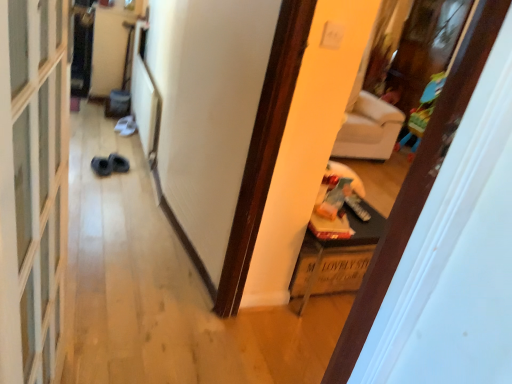
This screenshot has width=512, height=384. I want to click on plastic colorful playpen at upper right, so click(422, 112).

Measure the distance between point (25, 279) and camera.

Point (25, 279) is 34.88 inches away from camera.

What is the approximate height of wooden crate at lower right?

wooden crate at lower right is 18.16 inches tall.

Identify the location of plastic colorful playpen at upper right. This screenshot has width=512, height=384. (422, 112).

You are a GUI agent. You are given a task and a screenshot of the screen. Output one action in this format:
    pyautogui.click(x=<x>, y=<y>)
    Task: Click on the screen door above the wooden crate at lower right (from a real-world perspective)
    This screenshot has height=384, width=512.
    Given the screenshot: What is the action you would take?
    pyautogui.click(x=33, y=187)

From a real-world perspective, is transparent glass screen door at left above or below wooden crate at lower right?

Clearly, from a real-world perspective, transparent glass screen door at left is above wooden crate at lower right.

Looking at this image, considering the relative positions of transparent glass screen door at left and wooden crate at lower right in the image provided, is transparent glass screen door at left behind wooden crate at lower right?

No, transparent glass screen door at left is closer to the camera.

Can you confirm if transparent glass screen door at left is smaller than wooden crate at lower right?

No.

How distant is white matte door at center from transparent glass screen door at left?

31.93 inches.

Is white matte door at center outside of transparent glass screen door at left?

white matte door at center is positioned outside transparent glass screen door at left.

Image resolution: width=512 pixels, height=384 pixels. Find the location of `door above the transparent glass screen door at left (from a real-world perspective)`. door above the transparent glass screen door at left (from a real-world perspective) is located at coordinates (417, 186).

From a real-world perspective, is plastic colorful playpen at upper right positioned above or below transparent glass screen door at left?

In terms of real-world spatial position, plastic colorful playpen at upper right is below transparent glass screen door at left.

Is plastic colorful playpen at upper right shorter than transparent glass screen door at left?

Correct, plastic colorful playpen at upper right is not as tall as transparent glass screen door at left.

In the scene shown: Which is more to the right, plastic colorful playpen at upper right or transparent glass screen door at left?

From the viewer's perspective, plastic colorful playpen at upper right appears more on the right side.

Who is more distant, plastic colorful playpen at upper right or transparent glass screen door at left?

plastic colorful playpen at upper right is further from the camera.

Is plastic colorful playpen at upper right wider than white matte door at center?

Correct, the width of plastic colorful playpen at upper right exceeds that of white matte door at center.

Locate an element on the screen. The image size is (512, 384). door that is on the left side of plastic colorful playpen at upper right is located at coordinates (417, 186).

Which object is further away from the camera, plastic colorful playpen at upper right or white matte door at center?

plastic colorful playpen at upper right is more distant.

Who is taller, plastic colorful playpen at upper right or white matte door at center?

With more height is white matte door at center.

Is wooden crate at lower right at the back of black suede shoes at lower left?

No.

Considering the positions of objects black suede shoes at lower left and wooden crate at lower right in the image provided, who is more to the left, black suede shoes at lower left or wooden crate at lower right?

black suede shoes at lower left is more to the left.

Between black suede shoes at lower left and wooden crate at lower right, which one is positioned in front?

Positioned in front is wooden crate at lower right.

Do you think black suede shoes at lower left is within wooden crate at lower right, or outside of it?

black suede shoes at lower left is not enclosed by wooden crate at lower right.

The width and height of the screenshot is (512, 384). I want to click on screen door above the wooden crate at lower right (from the image's perspective), so click(x=33, y=187).

Does wooden crate at lower right have a greater height compared to transparent glass screen door at left?

In fact, wooden crate at lower right may be shorter than transparent glass screen door at left.

Is wooden crate at lower right behind transparent glass screen door at left?

Yes, wooden crate at lower right is behind transparent glass screen door at left.

Is transparent glass screen door at left positioned with its back to plastic colorful playpen at upper right?

No.

From a real-world perspective, is transparent glass screen door at left positioned above or below plastic colorful playpen at upper right?

In terms of real-world spatial position, transparent glass screen door at left is above plastic colorful playpen at upper right.

Considering the positions of points (23, 153) and (397, 150), is point (23, 153) closer to camera compared to point (397, 150)?

Yes.

Locate an element on the screen. screen door below the plastic colorful playpen at upper right (from the image's perspective) is located at coordinates (33, 187).

Locate an element on the screen. The image size is (512, 384). screen door that appears on the left of wooden crate at lower right is located at coordinates (33, 187).

At what (x,y) coordinates should I click in order to perform the action: click on screen door in front of the white matte door at center. Please return your answer as a coordinate pair (x, y). Looking at the image, I should click on (33, 187).

When comparing their distances from transparent glass screen door at left, does black suede shoes at lower left or white matte door at center seem closer?

The object closer to transparent glass screen door at left is white matte door at center.

Considering their positions, is white matte door at center positioned closer to black suede shoes at lower left than plastic colorful playpen at upper right?

plastic colorful playpen at upper right is positioned closer to the anchor black suede shoes at lower left.

Looking at this image, from the image, which object appears to be farther from transparent glass screen door at left, plastic colorful playpen at upper right or white matte door at center?

plastic colorful playpen at upper right.

Looking at the image, which one is located further to wooden crate at lower right, plastic colorful playpen at upper right or white matte door at center?

plastic colorful playpen at upper right lies further to wooden crate at lower right than the other object.

From the image, which object appears to be nearer to wooden crate at lower right, black suede shoes at lower left or white matte door at center?

white matte door at center.

Looking at the image, which one is located closer to wooden crate at lower right, white matte door at center or black suede shoes at lower left?

white matte door at center is closer to wooden crate at lower right.

Considering their positions, is transparent glass screen door at left positioned closer to black suede shoes at lower left than plastic colorful playpen at upper right?

The object closer to black suede shoes at lower left is transparent glass screen door at left.

Based on their spatial positions, is wooden crate at lower right or transparent glass screen door at left closer to black suede shoes at lower left?

wooden crate at lower right.

You are a GUI agent. You are given a task and a screenshot of the screen. Output one action in this format:
    pyautogui.click(x=<x>, y=<y>)
    Task: Click on the door positioned between transparent glass screen door at left and black suede shoes at lower left from near to far
    This screenshot has height=384, width=512.
    Given the screenshot: What is the action you would take?
    pyautogui.click(x=417, y=186)

Image resolution: width=512 pixels, height=384 pixels. I want to click on door positioned between transparent glass screen door at left and wooden crate at lower right from near to far, so click(x=417, y=186).

Find the location of a particular element. This screenshot has width=512, height=384. furniture between transparent glass screen door at left and plastic colorful playpen at upper right along the z-axis is located at coordinates (336, 258).

Identify the location of shoe located between transparent glass screen door at left and plastic colorful playpen at upper right in the depth direction. (110, 165).